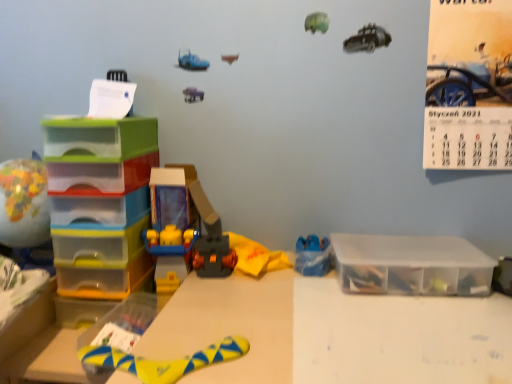
Question: Does rubberized plastic toy at center, arranged as the second toy when viewed from the left, have a larger size compared to clear plastic storage box at right?

Choices:
 (A) no
 (B) yes

Answer: (B)

Question: Is rubberized plastic toy at center, arranged as the second toy when viewed from the left, aimed at clear plastic storage box at right?

Choices:
 (A) yes
 (B) no

Answer: (B)

Question: Is rubberized plastic toy at center, arranged as the second toy when viewed from the left, positioned beyond the bounds of clear plastic storage box at right?

Choices:
 (A) no
 (B) yes

Answer: (B)

Question: Does rubberized plastic toy at center, arranged as the second toy when viewed from the left, have a smaller size compared to clear plastic storage box at right?

Choices:
 (A) yes
 (B) no

Answer: (B)

Question: From the image's perspective, is rubberized plastic toy at center, arranged as the second toy when viewed from the left, located beneath clear plastic storage box at right?

Choices:
 (A) no
 (B) yes

Answer: (A)

Question: Can you confirm if rubberized plastic toy at center, the 3th toy viewed from the right, is positioned to the left of clear plastic storage box at right?

Choices:
 (A) no
 (B) yes

Answer: (B)

Question: Is clear plastic storage box at right bigger than translucent plastic drawers at left?

Choices:
 (A) yes
 (B) no

Answer: (B)

Question: Considering the relative sizes of clear plastic storage box at right and translucent plastic drawers at left in the image provided, is clear plastic storage box at right shorter than translucent plastic drawers at left?

Choices:
 (A) no
 (B) yes

Answer: (B)

Question: Considering the relative sizes of clear plastic storage box at right and translucent plastic drawers at left in the image provided, is clear plastic storage box at right taller than translucent plastic drawers at left?

Choices:
 (A) no
 (B) yes

Answer: (A)

Question: From a real-world perspective, is clear plastic storage box at right positioned under translucent plastic drawers at left based on gravity?

Choices:
 (A) yes
 (B) no

Answer: (A)

Question: Is clear plastic storage box at right closer to camera compared to translucent plastic drawers at left?

Choices:
 (A) no
 (B) yes

Answer: (A)

Question: Is the depth of clear plastic storage box at right greater than that of translucent plastic drawers at left?

Choices:
 (A) yes
 (B) no

Answer: (A)

Question: Would you say translucent plastic drawers at left is part of yellow paper calendar at upper right's contents?

Choices:
 (A) no
 (B) yes

Answer: (A)